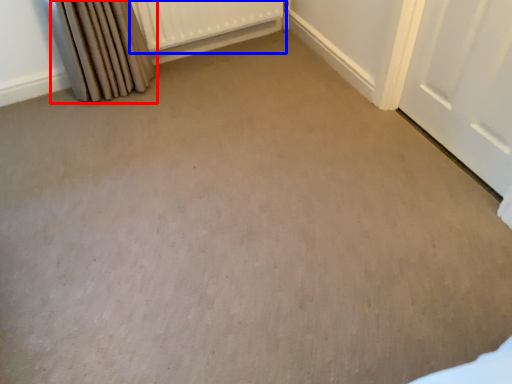
Question: Which point is further to the camera, curtain (highlighted by a red box) or radiator (highlighted by a blue box)?

Choices:
 (A) curtain
 (B) radiator

Answer: (B)